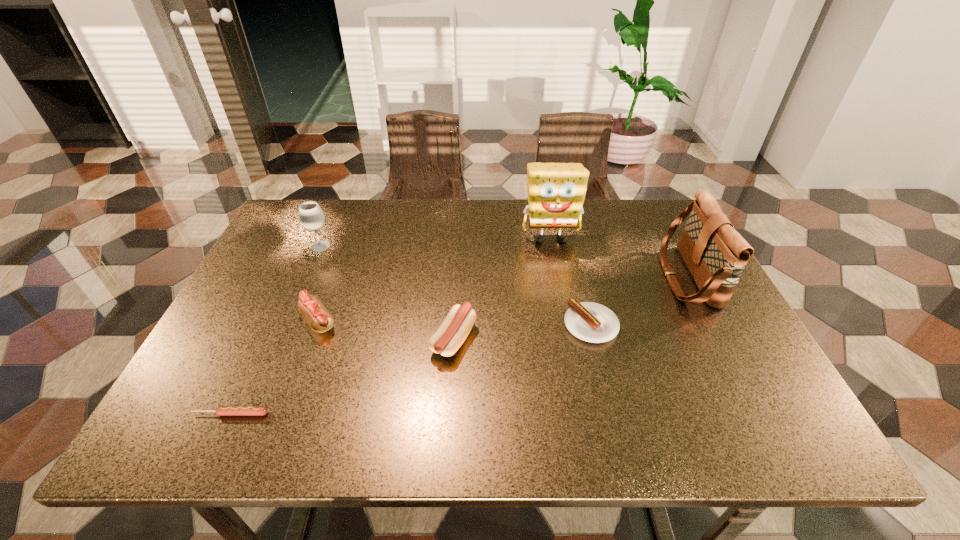
Identify the location of free space at the right edge of the desktop. (676, 249).

You are a GUI agent. You are given a task and a screenshot of the screen. Output one action in this format:
    pyautogui.click(x=<x>, y=<y>)
    Task: Click on the blank area at the far left corner
    This screenshot has width=960, height=540.
    Given the screenshot: What is the action you would take?
    pyautogui.click(x=327, y=218)

In the image, there is a desktop. Where is `vacant space at the near right corner`? The image size is (960, 540). vacant space at the near right corner is located at coordinates (781, 440).

Find the location of a particular element. The width and height of the screenshot is (960, 540). vacant space in between the sponge and the fourth object from left to right is located at coordinates (502, 288).

The width and height of the screenshot is (960, 540). I want to click on free space between the sponge and the second sausage from right to left, so click(x=502, y=288).

Where is `free space between the nearest sausage and the sponge`? The height and width of the screenshot is (540, 960). free space between the nearest sausage and the sponge is located at coordinates (391, 326).

Image resolution: width=960 pixels, height=540 pixels. In order to click on vacant area that lies between the nearest sausage and the fourth object from right to left in this screenshot , I will do `click(342, 376)`.

I want to click on vacant area between the shortest sausage and the sixth tallest object, so click(x=411, y=369).

Where is `vacant space that's between the sponge and the fourth object from right to left`? vacant space that's between the sponge and the fourth object from right to left is located at coordinates (502, 288).

Locate which object is the fourth closest to the third tallest sausage. Please provide its 2D coordinates. Your answer should be formatted as a tuple, i.e. [(x, y)], where the tuple contains the x and y coordinates of a point satisfying the conditions above.

[(320, 320)]